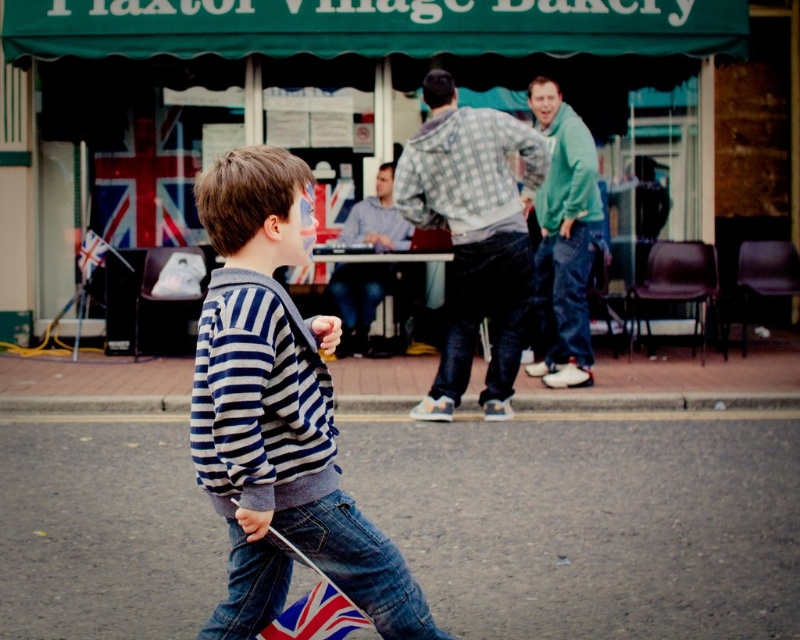
Question: Which of the following is the farthest from the observer?

Choices:
 (A) checkered fabric shirt at center
 (B) union jack flag at lower center

Answer: (A)

Question: Does blue striped shirt at center have a lesser width compared to union jack flag at lower center?

Choices:
 (A) yes
 (B) no

Answer: (B)

Question: In this image, where is striped sweater at center located relative to green fleece jacket at right?

Choices:
 (A) left
 (B) right

Answer: (A)

Question: Can you confirm if checkered fabric shirt at center is thinner than green fleece jacket at right?

Choices:
 (A) yes
 (B) no

Answer: (B)

Question: Which of the following is the farthest from the observer?

Choices:
 (A) union jack flag at lower center
 (B) blue striped shirt at center
 (C) striped sweater at center

Answer: (B)

Question: Estimate the real-world distances between objects in this image. Which object is farther from the green fleece jacket at right?

Choices:
 (A) striped sweater at center
 (B) union jack flag at lower center

Answer: (B)